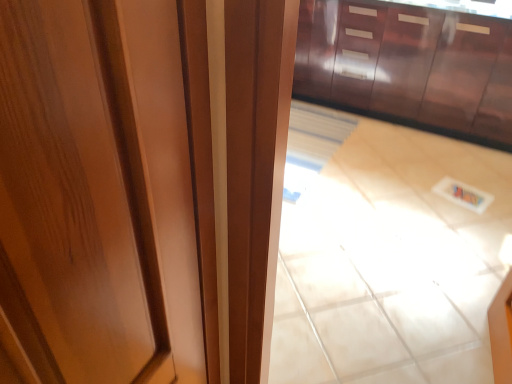
Measure the distance between point (401, 18) and camera.

Point (401, 18) is 8.94 feet away from camera.

Describe the element at coordinates (385, 255) in the screenshot. I see `beige glossy tile at center` at that location.

Where is `glossy wood door at center`? This screenshot has width=512, height=384. glossy wood door at center is located at coordinates (106, 192).

Identify the location of glossy wood cabinetry at upper center. The height and width of the screenshot is (384, 512). (408, 67).

Find the location of a particular element. door located on the left of beige glossy tile at center is located at coordinates (106, 192).

Looking at their sizes, would you say beige glossy tile at center is wider or thinner than glossy wood door at center?

In the image, beige glossy tile at center appears to be wider than glossy wood door at center.

Based on the photo, from a real-world perspective, who is located lower, beige glossy tile at center or glossy wood door at center?

From a 3D spatial view, glossy wood door at center is below.

Is beige glossy tile at center far away from glossy wood door at center?

beige glossy tile at center is far away from glossy wood door at center.

Consider the image. From a real-world perspective, which object rests below the other?

glossy wood door at center, from a real-world perspective.

How different are the orientations of glossy wood door at center and beige glossy tile at center in degrees?

The angular difference between glossy wood door at center and beige glossy tile at center is 93 degrees.

Based on the photo, can you confirm if glossy wood door at center is bigger than beige glossy tile at center?

No, glossy wood door at center is not bigger than beige glossy tile at center.

The image size is (512, 384). I want to click on cabinetry below the beige glossy tile at center (from a real-world perspective), so click(408, 67).

In the scene shown: Is beige glossy tile at center not near glossy wood cabinetry at upper center?

No, there isn't a large distance between beige glossy tile at center and glossy wood cabinetry at upper center.

Can you tell me how much beige glossy tile at center and glossy wood cabinetry at upper center differ in facing direction?

They differ by 179 degrees in their facing directions.

From the image's perspective, is beige glossy tile at center on top of glossy wood cabinetry at upper center?

No.

Between point (420, 117) and point (11, 54), which one is positioned behind?

The point (420, 117) is farther from the camera.

Consider the image. From a real-world perspective, is glossy wood cabinetry at upper center on top of glossy wood door at center?

No, from a real-world perspective, glossy wood cabinetry at upper center is not above glossy wood door at center.

Between glossy wood cabinetry at upper center and glossy wood door at center, which one has smaller width?

glossy wood door at center.

Does point (155, 363) appear closer or farther from the camera than point (444, 47)?

Point (155, 363) is positioned closer to the camera compared to point (444, 47).

Identify the location of door above the glossy wood cabinetry at upper center (from a real-world perspective). tap(106, 192).

Between glossy wood door at center and glossy wood cabinetry at upper center, which one has less height?

glossy wood cabinetry at upper center.

From the image's perspective, is glossy wood door at center over glossy wood cabinetry at upper center?

No, from the image's perspective, glossy wood door at center is not on top of glossy wood cabinetry at upper center.

I want to click on cabinetry below the beige glossy tile at center (from a real-world perspective), so click(408, 67).

From the image's perspective, which object appears higher, glossy wood cabinetry at upper center or beige glossy tile at center?

glossy wood cabinetry at upper center is shown above in the image.

Is glossy wood cabinetry at upper center wider or thinner than beige glossy tile at center?

glossy wood cabinetry at upper center is wider than beige glossy tile at center.

Considering the sizes of objects glossy wood cabinetry at upper center and beige glossy tile at center in the image provided, who is taller, glossy wood cabinetry at upper center or beige glossy tile at center?

With more height is beige glossy tile at center.

What are the coordinates of `tile that is above the glossy wood door at center (from a real-world perspective)` in the screenshot? It's located at (385, 255).

Identify the location of tile behind the glossy wood door at center. The height and width of the screenshot is (384, 512). (385, 255).

Considering their positions, is glossy wood door at center positioned further to glossy wood cabinetry at upper center than beige glossy tile at center?

glossy wood door at center is further to glossy wood cabinetry at upper center.

Looking at the image, which one is located further to glossy wood door at center, beige glossy tile at center or glossy wood cabinetry at upper center?

glossy wood cabinetry at upper center lies further to glossy wood door at center than the other object.

Which object lies further to the anchor point beige glossy tile at center, glossy wood cabinetry at upper center or glossy wood door at center?

The object further to beige glossy tile at center is glossy wood door at center.

From the image, which object appears to be farther from glossy wood door at center, glossy wood cabinetry at upper center or beige glossy tile at center?

Based on the image, glossy wood cabinetry at upper center appears to be further to glossy wood door at center.

When comparing their distances from glossy wood cabinetry at upper center, does beige glossy tile at center or glossy wood door at center seem further?

Based on the image, glossy wood door at center appears to be further to glossy wood cabinetry at upper center.

Considering their positions, is glossy wood door at center positioned closer to beige glossy tile at center than glossy wood cabinetry at upper center?

The object closer to beige glossy tile at center is glossy wood cabinetry at upper center.

Find the location of a particular element. tile between glossy wood door at center and glossy wood cabinetry at upper center along the z-axis is located at coordinates (385, 255).